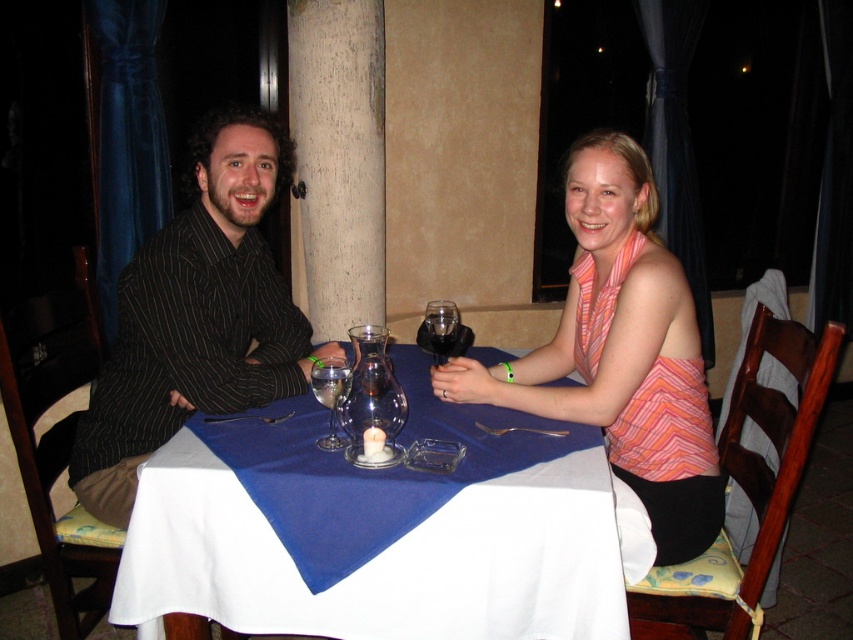
Question: Which object is the closest to the transparent glass at table center?

Choices:
 (A) clear glass wine at center
 (B) clear glass wine glass at center

Answer: (B)

Question: Which of the following is the farthest from the observer?

Choices:
 (A) blue fabric table at center
 (B) clear glass wine at center
 (C) matte black shirt at left
 (D) clear glass wine glass at center

Answer: (C)

Question: Can you confirm if pink striped tank top at center is positioned to the right of clear glass wine at center?

Choices:
 (A) yes
 (B) no

Answer: (A)

Question: Which of the following is the farthest from the observer?

Choices:
 (A) [x=437, y=339]
 (B) [x=511, y=580]
 (C) [x=692, y=436]

Answer: (A)

Question: Can you confirm if matte black shirt at left is bigger than transparent glass at table center?

Choices:
 (A) yes
 (B) no

Answer: (A)

Question: Can you confirm if matte black shirt at left is positioned to the right of clear glass wine glass at center?

Choices:
 (A) no
 (B) yes

Answer: (A)